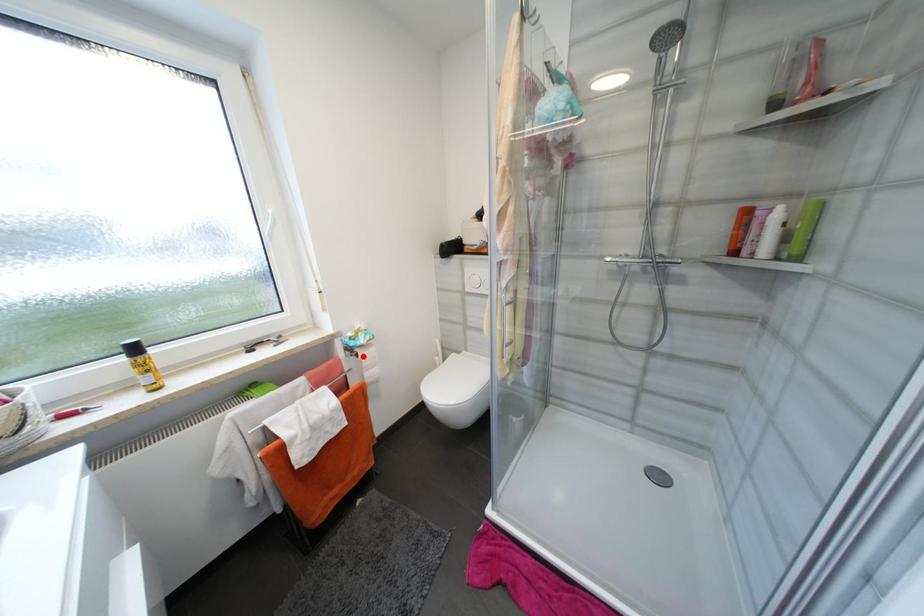
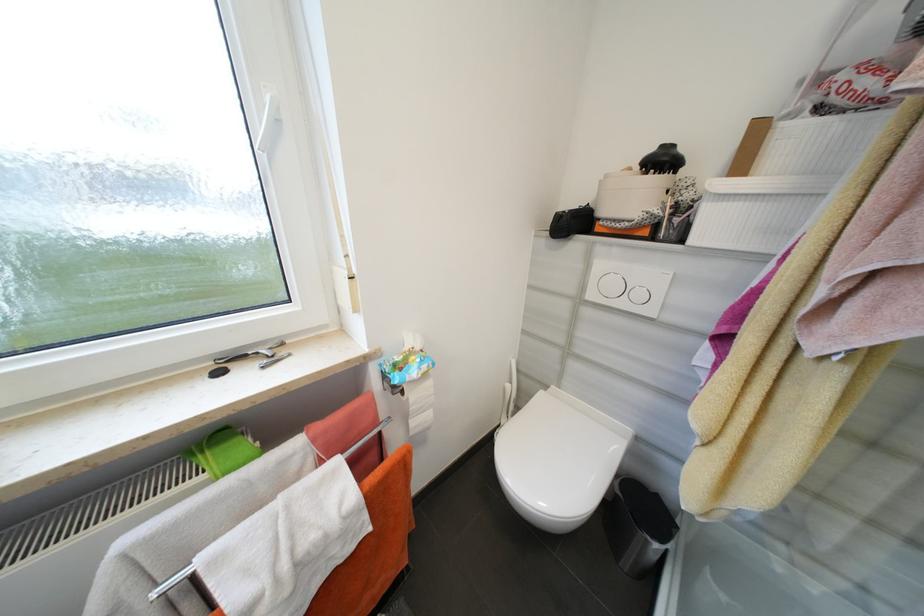
Question: I am providing you with two images of the same scene from different viewpoints. In image1, a red point is highlighted. Considering the same 3D point in image2, which of the following is correct?

Choices:
 (A) It is closer
 (B) It is farther

Answer: (B)